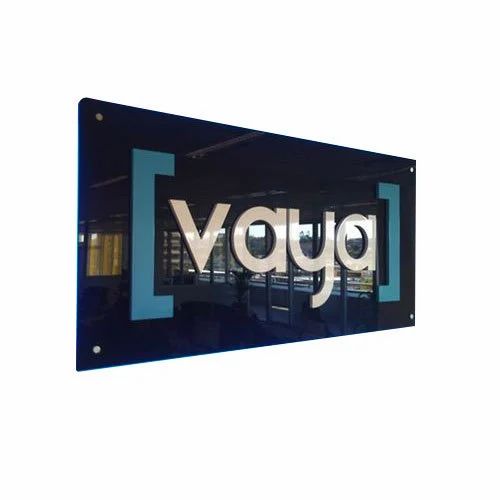
Where is `ceiling`? This screenshot has height=500, width=500. ceiling is located at coordinates (160, 130).